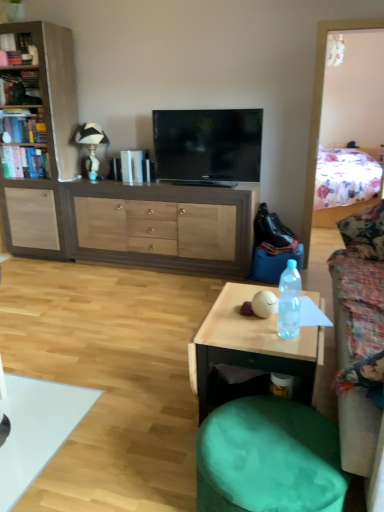
The width and height of the screenshot is (384, 512). In order to click on free spot to the left of wooden table at center in this screenshot , I will do `click(147, 410)`.